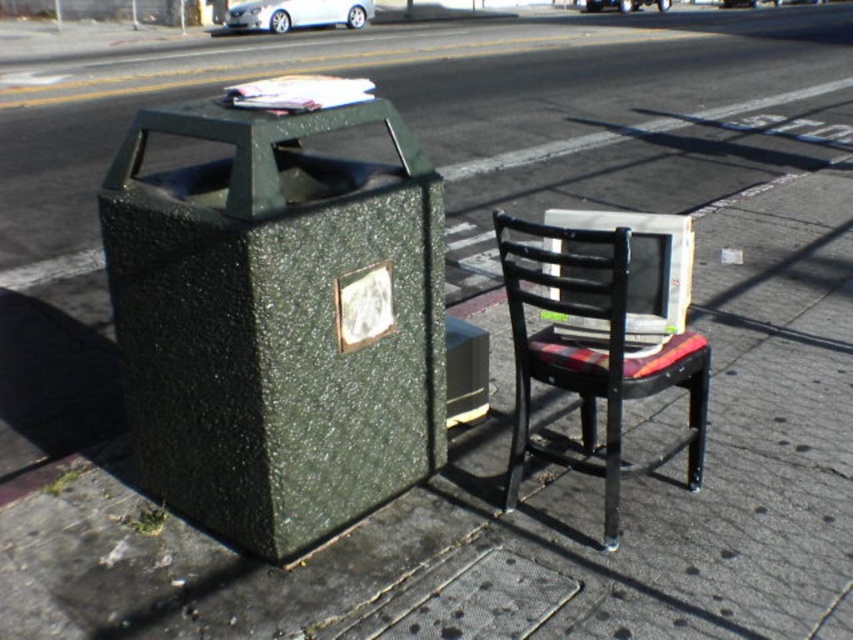
Does green speckled trash can at left have a lesser width compared to plaid fabric chair at center?

No, green speckled trash can at left is not thinner than plaid fabric chair at center.

Can you confirm if green speckled trash can at left is positioned to the left of plaid fabric chair at center?

Indeed, green speckled trash can at left is positioned on the left side of plaid fabric chair at center.

Is point (201, 292) closer to camera compared to point (589, 248)?

Yes, it is in front of point (589, 248).

Where is `green speckled trash can at left`? green speckled trash can at left is located at coordinates (277, 321).